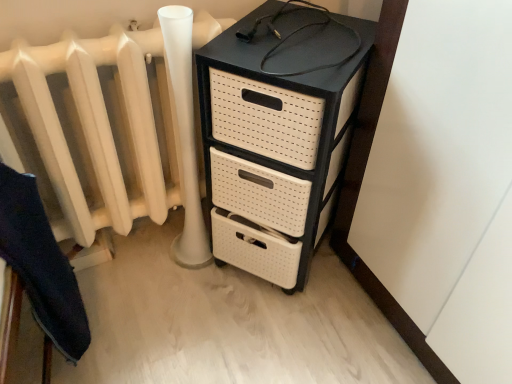
This screenshot has width=512, height=384. What are the coordinates of `white matte radiator at left` in the screenshot? It's located at (115, 130).

Looking at their sizes, would you say white matte radiator at left is wider or thinner than dark blue fabric at lower left?

In the image, white matte radiator at left appears to be more narrow than dark blue fabric at lower left.

Which of these two, white matte radiator at left or dark blue fabric at lower left, stands shorter?

white matte radiator at left is shorter.

Which object is closer to the camera, white matte radiator at left or dark blue fabric at lower left?

dark blue fabric at lower left is closer to the camera.

Considering the positions of objects white matte radiator at left and dark blue fabric at lower left in the image provided, who is more to the right, white matte radiator at left or dark blue fabric at lower left?

white matte radiator at left is more to the right.

Would you say dark blue fabric at lower left is outside black plastic chest of drawers at upper right?

Yes, dark blue fabric at lower left is outside of black plastic chest of drawers at upper right.

Can you tell me how much dark blue fabric at lower left and black plastic chest of drawers at upper right differ in facing direction?

They differ by 44.8 degrees in their facing directions.

Does point (45, 246) lie in front of point (343, 90)?

Yes, it is.

This screenshot has width=512, height=384. In order to click on furniture below the black plastic chest of drawers at upper right (from the image's perspective) in this screenshot , I will do `click(41, 269)`.

Considering the sizes of objects black plastic chest of drawers at upper right and dark blue fabric at lower left in the image provided, who is taller, black plastic chest of drawers at upper right or dark blue fabric at lower left?

black plastic chest of drawers at upper right.

From the picture: In terms of width, does black plastic chest of drawers at upper right look wider or thinner when compared to dark blue fabric at lower left?

In the image, black plastic chest of drawers at upper right appears to be wider than dark blue fabric at lower left.

Is black plastic chest of drawers at upper right looking in the opposite direction of dark blue fabric at lower left?

black plastic chest of drawers at upper right does not have its back to dark blue fabric at lower left.

From the image's perspective, is white matte radiator at left below black plastic chest of drawers at upper right?

No, from the image's perspective, white matte radiator at left is not beneath black plastic chest of drawers at upper right.

Can you confirm if white matte radiator at left is smaller than black plastic chest of drawers at upper right?

Yes, white matte radiator at left is smaller than black plastic chest of drawers at upper right.

Is black plastic chest of drawers at upper right located within white matte radiator at left?

No, black plastic chest of drawers at upper right is not surrounded by white matte radiator at left.

Can you confirm if white matte radiator at left is thinner than black plastic chest of drawers at upper right?

Indeed, white matte radiator at left has a lesser width compared to black plastic chest of drawers at upper right.

Who is taller, black plastic chest of drawers at upper right or white matte radiator at left?

black plastic chest of drawers at upper right.

Which object is further away from the camera taking this photo, black plastic chest of drawers at upper right or white matte radiator at left?

white matte radiator at left is further away from the camera.

How different are the orientations of black plastic chest of drawers at upper right and white matte radiator at left in degrees?

The facing directions of black plastic chest of drawers at upper right and white matte radiator at left are 52.5 degrees apart.

Is black plastic chest of drawers at upper right positioned with its back to white matte radiator at left?

No.

Which object is wider, dark blue fabric at lower left or white matte radiator at left?

dark blue fabric at lower left.

I want to click on furniture below the white matte radiator at left (from the image's perspective), so click(41, 269).

Between dark blue fabric at lower left and white matte radiator at left, which one has smaller size?

With smaller size is dark blue fabric at lower left.

Identify the location of radiator located above the dark blue fabric at lower left (from a real-world perspective). The width and height of the screenshot is (512, 384). (115, 130).

Image resolution: width=512 pixels, height=384 pixels. I want to click on furniture below the black plastic chest of drawers at upper right (from the image's perspective), so click(x=41, y=269).

From the image, which object appears to be farther from dark blue fabric at lower left, black plastic chest of drawers at upper right or white matte radiator at left?

The object further to dark blue fabric at lower left is black plastic chest of drawers at upper right.

Looking at the image, which one is located further to white matte radiator at left, black plastic chest of drawers at upper right or dark blue fabric at lower left?

Among the two, dark blue fabric at lower left is located further to white matte radiator at left.

Which object lies nearer to the anchor point white matte radiator at left, dark blue fabric at lower left or black plastic chest of drawers at upper right?

Based on the image, black plastic chest of drawers at upper right appears to be nearer to white matte radiator at left.

From the image, which object appears to be nearer to dark blue fabric at lower left, white matte radiator at left or black plastic chest of drawers at upper right?

white matte radiator at left lies closer to dark blue fabric at lower left than the other object.

From the picture: Based on their spatial positions, is white matte radiator at left or dark blue fabric at lower left further from black plastic chest of drawers at upper right?

dark blue fabric at lower left lies further to black plastic chest of drawers at upper right than the other object.

From the image, which object appears to be farther from black plastic chest of drawers at upper right, dark blue fabric at lower left or white matte radiator at left?

dark blue fabric at lower left is positioned further to the anchor black plastic chest of drawers at upper right.

Locate an element on the screen. The height and width of the screenshot is (384, 512). radiator between dark blue fabric at lower left and black plastic chest of drawers at upper right from left to right is located at coordinates (115, 130).